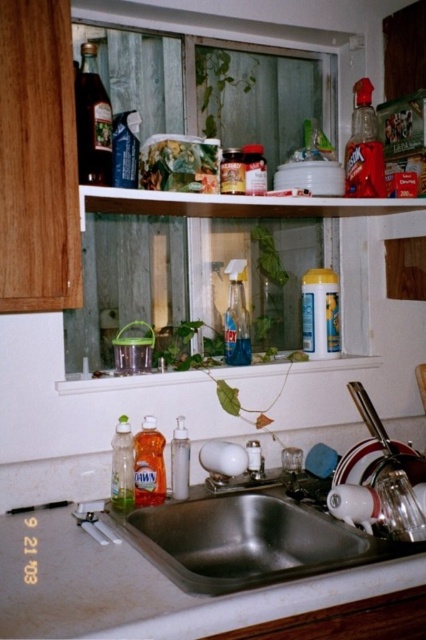
Question: Estimate the real-world distances between objects in this image. Which object is closer to the dark brown glass bottle at upper left?

Choices:
 (A) clear glass spray bottle at center
 (B) translucent plastic bottle at upper right

Answer: (A)

Question: Which of the following is the farthest from the observer?

Choices:
 (A) translucent orange liquid at sink left
 (B) clear glass spray bottle at center
 (C) translucent plastic bottle at upper right

Answer: (B)

Question: Does dark brown glass bottle at upper left appear under clear glass spray bottle at center?

Choices:
 (A) no
 (B) yes

Answer: (A)

Question: Based on their relative distances, which object is farther from the dark brown glass bottle at upper left?

Choices:
 (A) translucent plastic dish soap at sink left
 (B) clear glass spray bottle at center
 (C) yellow matte container at upper center

Answer: (C)

Question: Is dark brown glass bottle at upper left behind clear plastic bottle at sink?

Choices:
 (A) yes
 (B) no

Answer: (B)

Question: Does yellow matte container at upper center appear on the left side of translucent plastic jar at center?

Choices:
 (A) no
 (B) yes

Answer: (A)